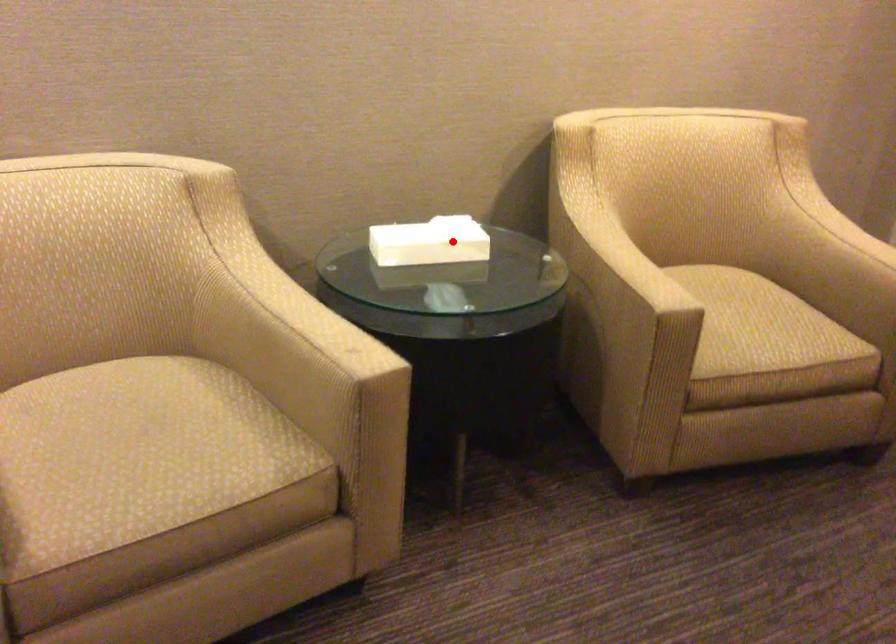
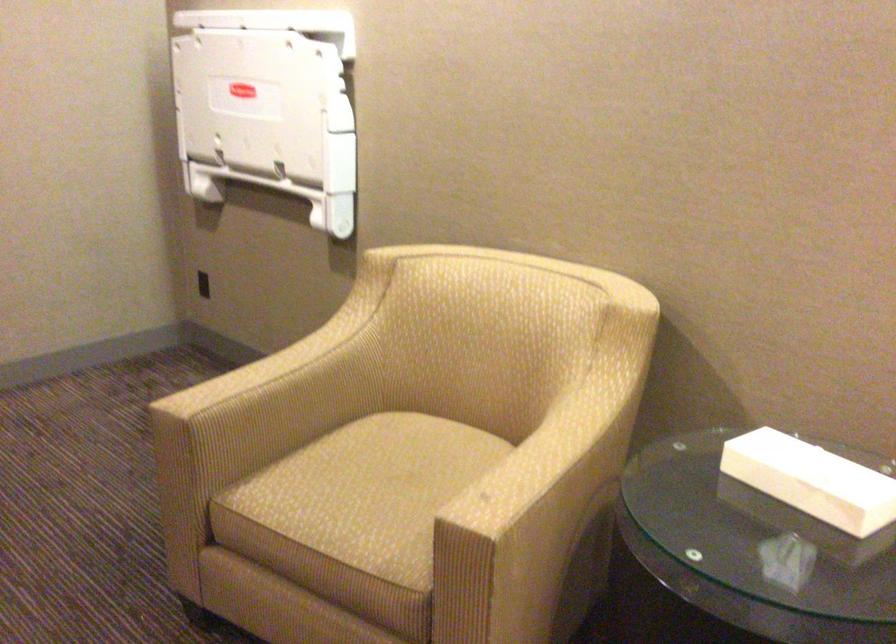
Find the pixel in the second image that matches the highlighted location in the first image.

(812, 480)